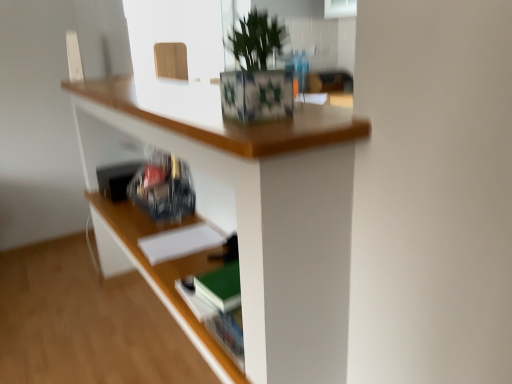
Question: Is green leafy plant at upper center positioned with its back to white matte paper at center?

Choices:
 (A) no
 (B) yes

Answer: (A)

Question: Considering the relative sizes of green leafy plant at upper center and white matte paper at center in the image provided, is green leafy plant at upper center bigger than white matte paper at center?

Choices:
 (A) no
 (B) yes

Answer: (B)

Question: Is white matte paper at center completely or partially inside green leafy plant at upper center?

Choices:
 (A) no
 (B) yes

Answer: (A)

Question: Considering the relative sizes of green leafy plant at upper center and white matte paper at center in the image provided, is green leafy plant at upper center shorter than white matte paper at center?

Choices:
 (A) yes
 (B) no

Answer: (B)

Question: Can you confirm if green leafy plant at upper center is wider than white matte paper at center?

Choices:
 (A) no
 (B) yes

Answer: (A)

Question: Considering the relative positions of green leafy plant at upper center and white matte paper at center in the image provided, is green leafy plant at upper center in front of white matte paper at center?

Choices:
 (A) no
 (B) yes

Answer: (B)

Question: From a real-world perspective, is green leafy plant at upper center over wooden desk at upper center?

Choices:
 (A) no
 (B) yes

Answer: (B)

Question: Is green leafy plant at upper center directly adjacent to wooden desk at upper center?

Choices:
 (A) yes
 (B) no

Answer: (B)

Question: From the image's perspective, does green leafy plant at upper center appear higher than wooden desk at upper center?

Choices:
 (A) yes
 (B) no

Answer: (A)

Question: Does green leafy plant at upper center contain wooden desk at upper center?

Choices:
 (A) no
 (B) yes

Answer: (A)

Question: Is green leafy plant at upper center wider than wooden desk at upper center?

Choices:
 (A) yes
 (B) no

Answer: (B)

Question: Considering the relative sizes of green leafy plant at upper center and wooden desk at upper center in the image provided, is green leafy plant at upper center shorter than wooden desk at upper center?

Choices:
 (A) yes
 (B) no

Answer: (A)

Question: Is white matte paper at center not close to green leafy plant at upper center?

Choices:
 (A) no
 (B) yes

Answer: (A)